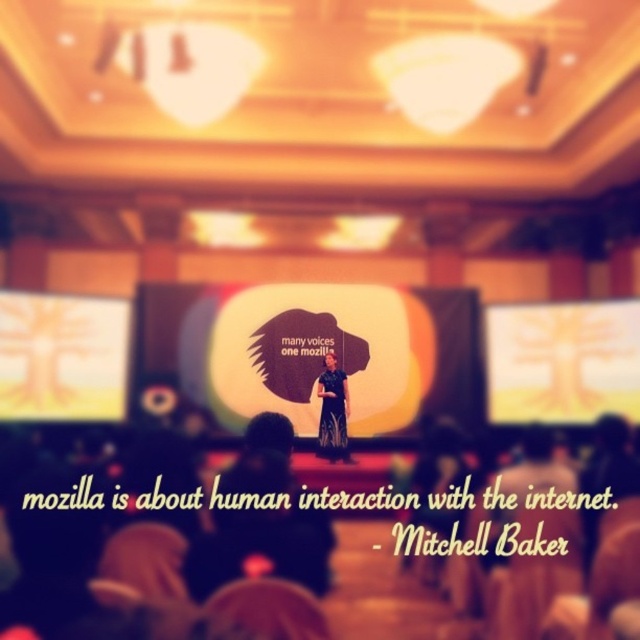
Question: Which object appears closest to the camera in this image?

Choices:
 (A) yellow matte projection screen at upper left
 (B) black satin dress at center
 (C) white matte projection screen at center

Answer: (A)

Question: Can you confirm if white matte projection screen at center is positioned to the right of yellow matte projection screen at upper left?

Choices:
 (A) yes
 (B) no

Answer: (A)

Question: Which of the following is the farthest from the observer?

Choices:
 (A) white matte projection screen at center
 (B) yellow matte projection screen at upper left

Answer: (A)

Question: Does white matte projection screen at center appear on the right side of yellow matte projection screen at upper center?

Choices:
 (A) no
 (B) yes

Answer: (A)

Question: Based on their relative distances, which object is nearer to the black satin dress at center?

Choices:
 (A) yellow matte projection screen at upper center
 (B) white matte projection screen at center
 (C) yellow matte projection screen at upper left

Answer: (B)

Question: Does white matte projection screen at center appear on the right side of yellow matte projection screen at upper center?

Choices:
 (A) yes
 (B) no

Answer: (B)